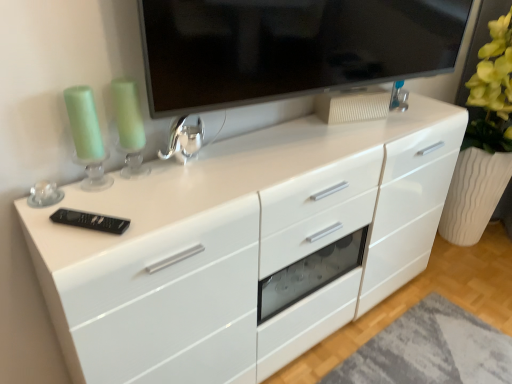
The height and width of the screenshot is (384, 512). Identify the location of vacant space in front of shiny metallic faucet at center, which is the 2th appliance from front to back. (172, 192).